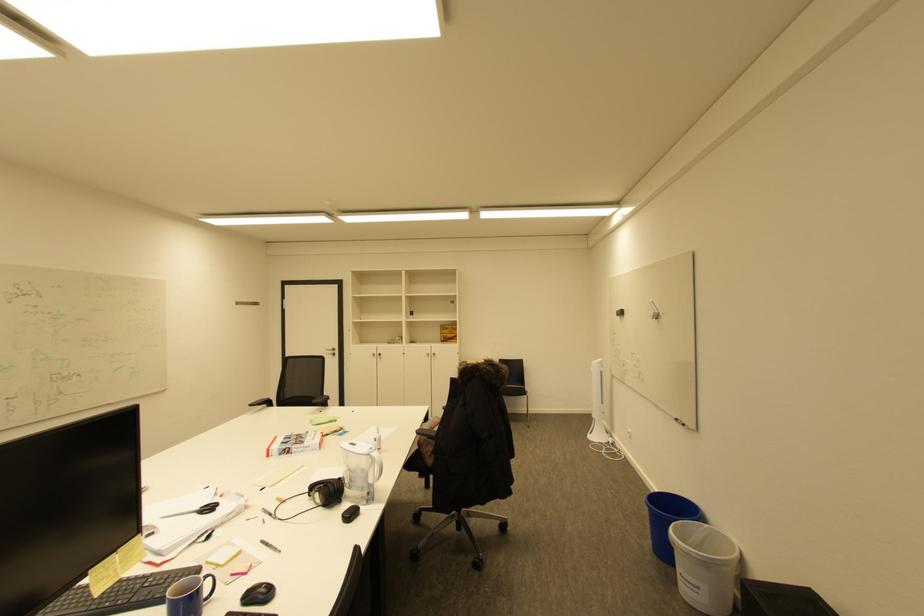
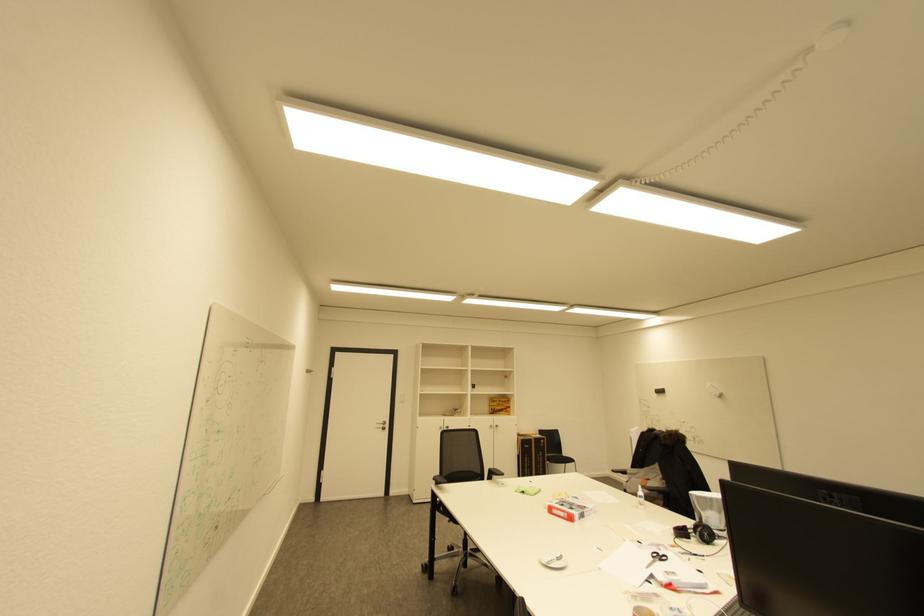
Where in the second image is the point corresponding to the point at 335,354 from the first image?

(385, 429)